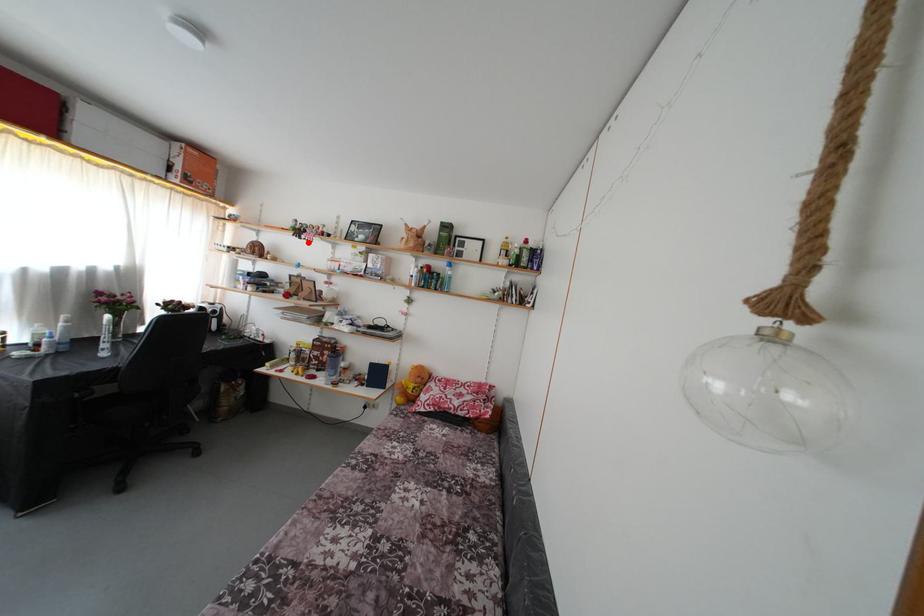
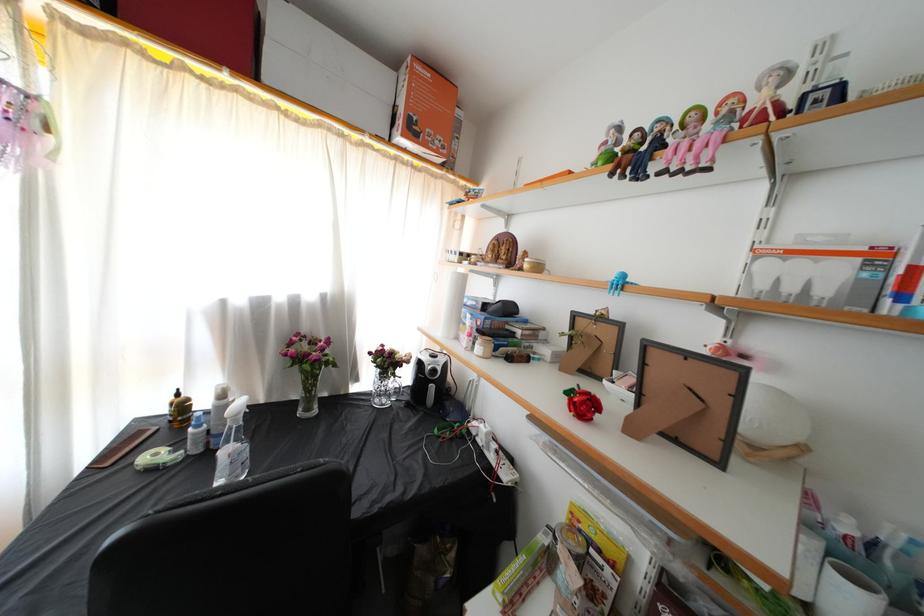
Find the pixel in the second image that matches the highlighted location in the first image.

(659, 172)